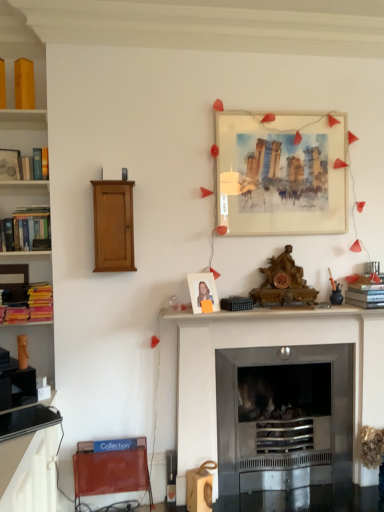
Question: From the image's perspective, relative to matte white photo frame at center, the second picture frame positioned from the right, is metallic silver fireplace at center above or below?

Choices:
 (A) below
 (B) above

Answer: (A)

Question: Is metallic silver fireplace at center spatially inside matte white photo frame at center, the 1th picture frame viewed from the front, or outside of it?

Choices:
 (A) inside
 (B) outside

Answer: (B)

Question: Which object is positioned farthest from the hardcover book at left, arranged as the 1th book when viewed from the left?

Choices:
 (A) hardcover book at right, which is the 1th book from right to left
 (B) matte paper picture frame at upper center, the second picture frame when ordered from left to right
 (C) metallic silver fireplace at center
 (D) matte white photo frame at center, the second picture frame positioned from the right
 (E) hardcover books at left

Answer: (A)

Question: Which object is positioned farthest from the matte white photo frame at center, arranged as the second picture frame when viewed from the back?

Choices:
 (A) hardcover book at right, the second book positioned from the left
 (B) matte paper picture frame at upper center, which ranks as the second picture frame in bottom-to-top order
 (C) hardcover book at left, the second book positioned from the right
 (D) hardcover books at left
 (E) metallic silver fireplace at center

Answer: (C)